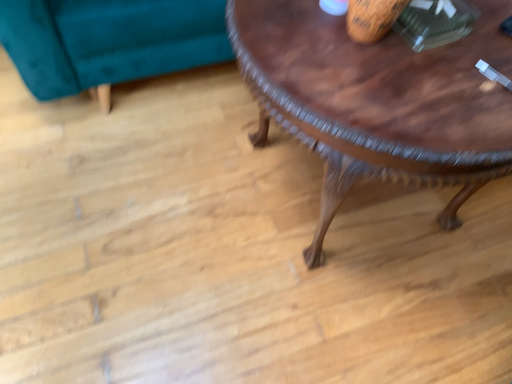
Where is `vacant area that is in front of teal velvet swivel chair at upper left`? The image size is (512, 384). vacant area that is in front of teal velvet swivel chair at upper left is located at coordinates (115, 194).